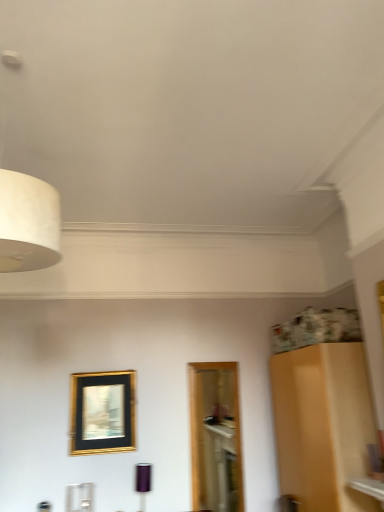
Question: Would you say white matte lampshade at upper left, positioned as the 2th lamp in bottom-to-top order, is inside or outside gold/black/glass picture frame at center?

Choices:
 (A) outside
 (B) inside

Answer: (A)

Question: Considering the positions of white matte lampshade at upper left, the 2th lamp positioned from the right, and gold/black/glass picture frame at center in the image, is white matte lampshade at upper left, the 2th lamp positioned from the right, taller or shorter than gold/black/glass picture frame at center?

Choices:
 (A) short
 (B) tall

Answer: (B)

Question: Which is nearer to the matte black lampshade at lower center, which ranks as the 2th lamp in top-to-bottom order?

Choices:
 (A) white matte lampshade at upper left, the second lamp when ordered from back to front
 (B) gold/black/glass picture frame at center

Answer: (B)

Question: Which object is positioned closest to the gold/black/glass picture frame at center?

Choices:
 (A) matte black lampshade at lower center, which is counted as the 2th lamp, starting from the left
 (B) white matte lampshade at upper left, the 2th lamp positioned from the right

Answer: (A)